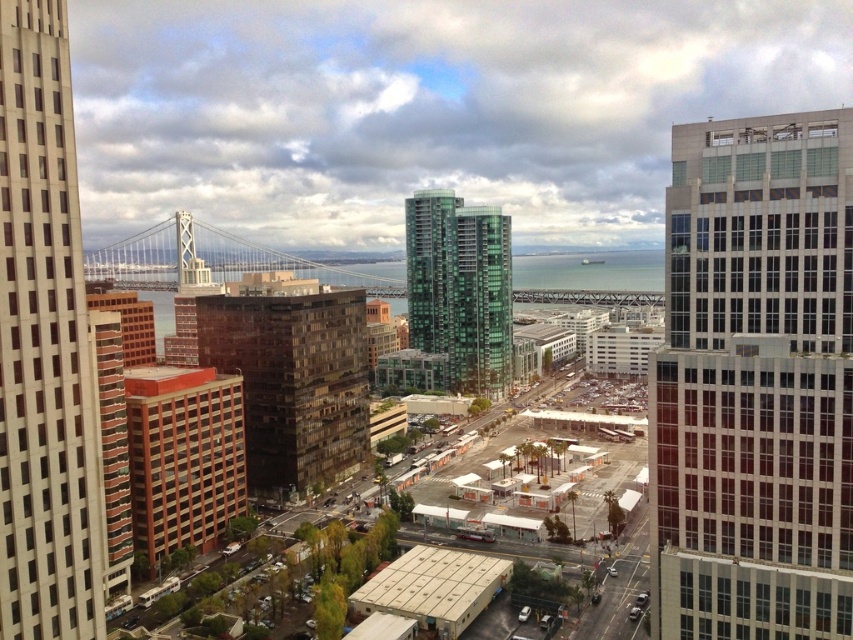
You are a city planner analyzing the urban layout. Given the white glass skyscraper at left, can you determine its position relative to the center of the image using the coordinate system provided?

The white glass skyscraper at left is located at point coordinates of 0.542 on the x and 0.053 on the y axis, which places it near the lower left quadrant of the image.